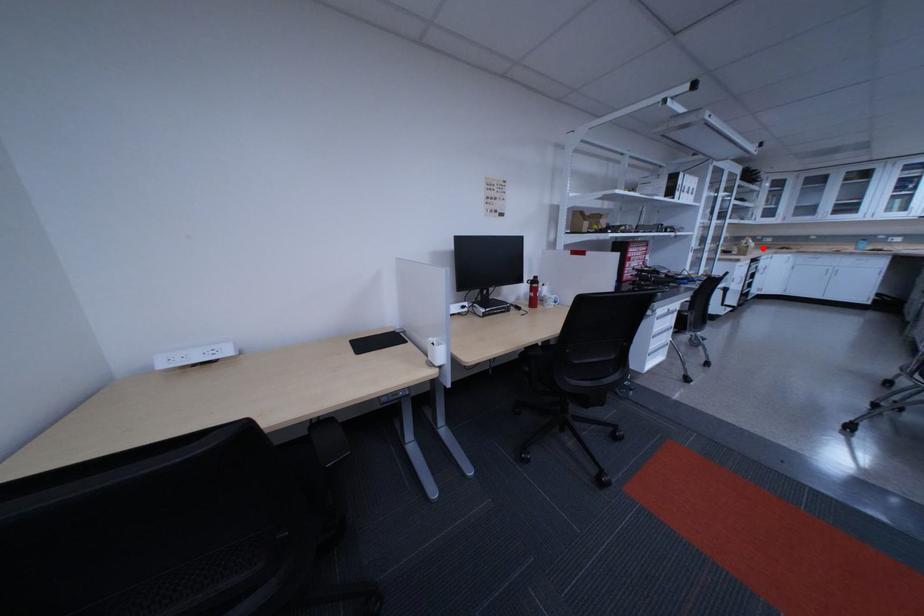
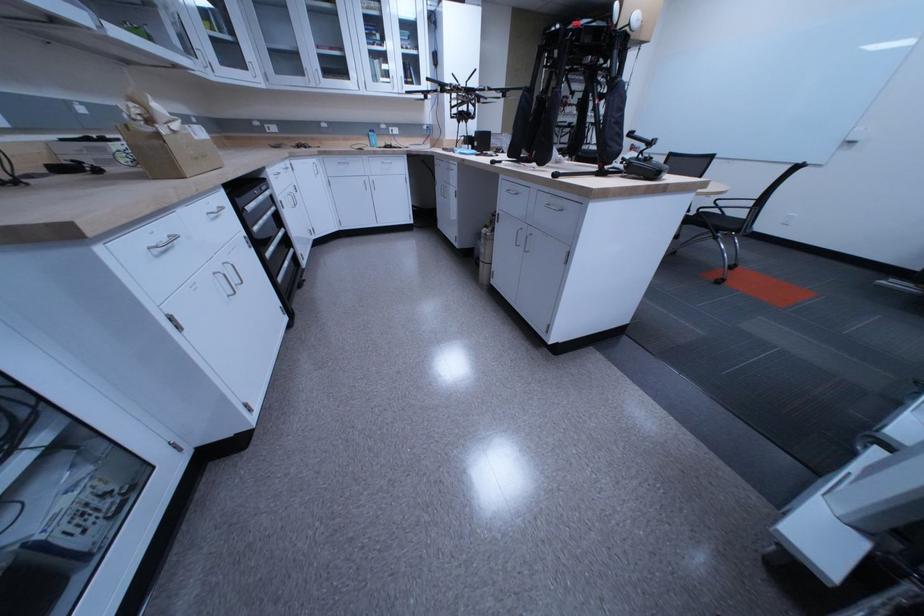
Question: I am providing you with two images of the same scene from different viewpoints. A red point is marked on the first image. At the location where the point appears in image 1, is it still visible in image 2?

Choices:
 (A) Yes
 (B) No

Answer: (A)